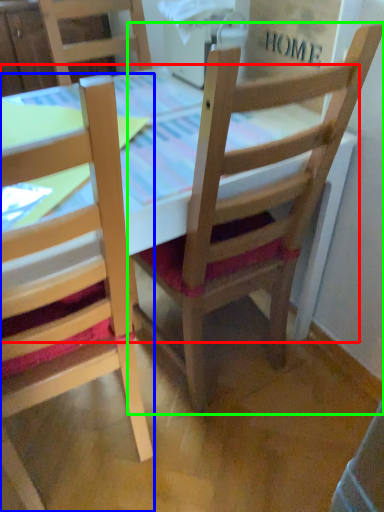
Question: Which is farther away from table (highlighted by a red box)? chair (highlighted by a blue box) or chair (highlighted by a green box)?

Choices:
 (A) chair
 (B) chair

Answer: (A)